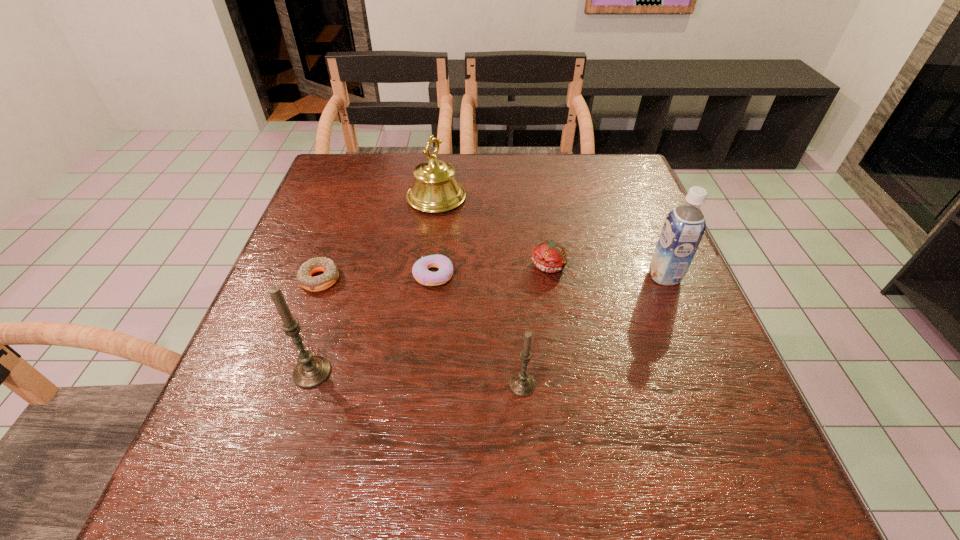
Locate an element on the screen. Image resolution: width=960 pixels, height=540 pixels. vacant region located on the right of the taller candle is located at coordinates (463, 372).

Locate an element on the screen. The height and width of the screenshot is (540, 960). vacant space located on the left of the third object from right to left is located at coordinates (290, 385).

The height and width of the screenshot is (540, 960). I want to click on free point located 0.390m on the front of the farthest object, so click(420, 338).

This screenshot has height=540, width=960. Find the location of `vacant space located 0.250m on the front of the left doughnut`. vacant space located 0.250m on the front of the left doughnut is located at coordinates (276, 401).

Locate an element on the screen. free space located 0.060m on the front of the tomato is located at coordinates (556, 299).

The height and width of the screenshot is (540, 960). I want to click on vacant space located 0.150m on the left of the right doughnut, so click(346, 275).

In order to click on free space located on the label of the rightmost object in this screenshot , I will do `click(568, 276)`.

At what (x,y) coordinates should I click in order to perform the action: click on vacant space located 0.140m on the label of the rightmost object. Please return your answer as a coordinate pair (x, y). Image resolution: width=960 pixels, height=540 pixels. Looking at the image, I should click on pos(587,276).

At what (x,y) coordinates should I click in order to perform the action: click on vacant region located 0.190m on the label of the rightmost object. Please return your answer as a coordinate pair (x, y). Image resolution: width=960 pixels, height=540 pixels. Looking at the image, I should click on (564, 276).

Where is `object that is at the far edge`? object that is at the far edge is located at coordinates (435, 189).